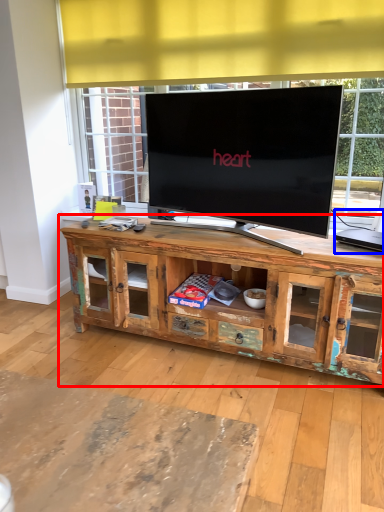
Question: Which object is further to the camera taking this photo, cabinetry (highlighted by a red box) or computer (highlighted by a blue box)?

Choices:
 (A) cabinetry
 (B) computer

Answer: (B)